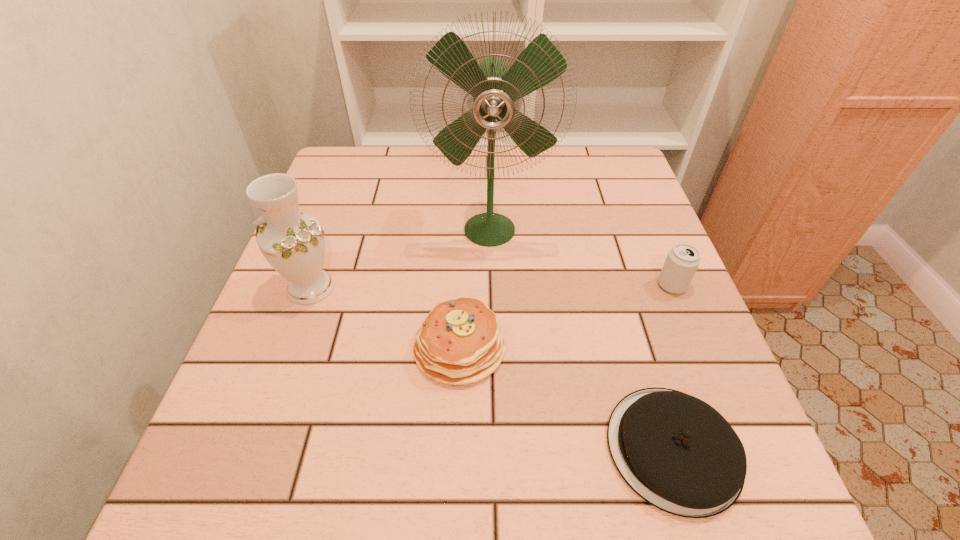
Locate an element on the screen. Image resolution: width=960 pixels, height=540 pixels. free spot between the can and the farthest object is located at coordinates (581, 257).

Where is `free spot between the farthest object and the taller pancake`? free spot between the farthest object and the taller pancake is located at coordinates (474, 288).

The width and height of the screenshot is (960, 540). In order to click on vacant space in between the second nearest object and the tallest object in this screenshot , I will do `click(474, 288)`.

I want to click on free spot between the farthest object and the fourth shortest object, so click(x=400, y=258).

The width and height of the screenshot is (960, 540). I want to click on object that is the third closest one to the can, so click(459, 342).

Choose which object is the third nearest neighbor to the nearest object. Please provide its 2D coordinates. Your answer should be formatted as a tuple, i.e. [(x, y)], where the tuple contains the x and y coordinates of a point satisfying the conditions above.

[(494, 89)]

The width and height of the screenshot is (960, 540). Find the location of `free location that satisfies the following two spatial constraints: 1. on the front-facing side of the can; 2. on the right side of the fan`. free location that satisfies the following two spatial constraints: 1. on the front-facing side of the can; 2. on the right side of the fan is located at coordinates (491, 285).

Locate an element on the screen. vacant space that satisfies the following two spatial constraints: 1. on the front-facing side of the fan; 2. on the right side of the nearest object is located at coordinates (494, 449).

You are a GUI agent. You are given a task and a screenshot of the screen. Output one action in this format:
    pyautogui.click(x=<x>, y=<y>)
    Task: Click on the free space that satisfies the following two spatial constraints: 1. on the front-facing side of the fan; 2. on the left side of the nearer pancake
    The image size is (960, 540).
    Given the screenshot: What is the action you would take?
    click(494, 449)